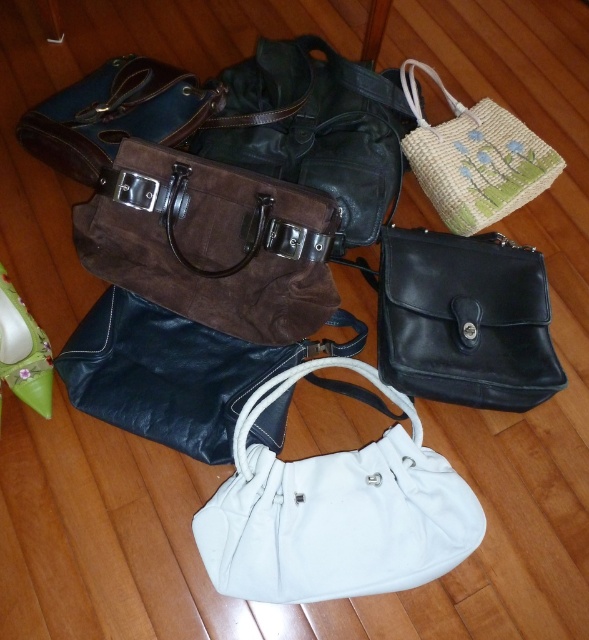
You are standing at the entrance of the room and see two points marked on the floor. The first point is at location point (226, 356) and the second point is at point (196, 84). Which point is closer to you?

Point (226, 356) is in front of point (196, 84), so it is closer to you.

You are standing in front of the black leather handbag at center. If you take one step forward, will you be closer than 3 feet to it?

The black leather handbag at center is currently 3.97 feet away. Taking one step forward would reduce the distance, but unless the step covers more than 0.97 feet, you would still be slightly over 3 feet away. However, typical step lengths vary, so if your step is at least 1 foot, you would be within 3 feet.

You are standing in the room and want to pick up the black leather handbag at center and the woven straw bag at upper right. Which one can you reach first without moving your feet?

The black leather handbag at center can be reached first because it is closer to the viewer than the woven straw bag at upper right.